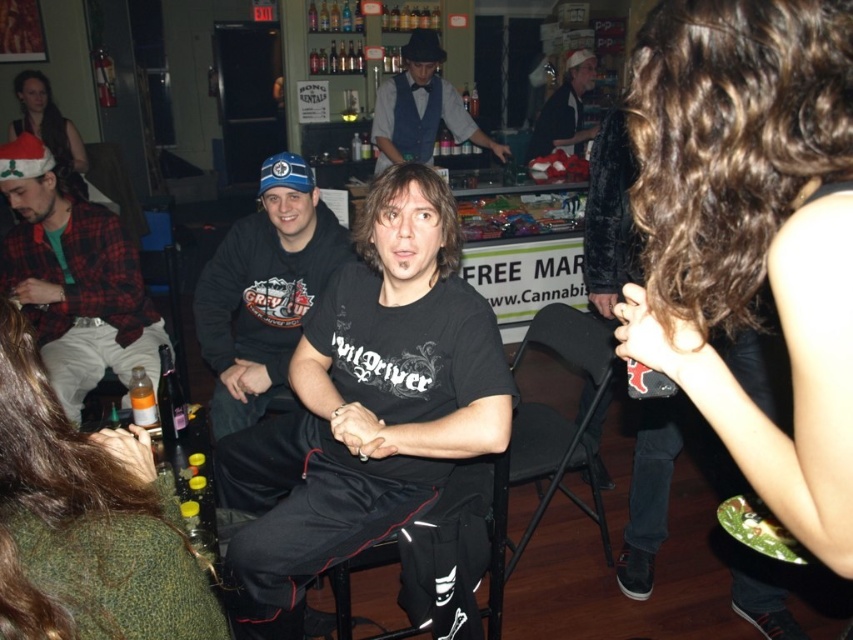
Question: Can you confirm if black matte t-shirt at center is wider than matte black shirt at center?

Choices:
 (A) no
 (B) yes

Answer: (B)

Question: Is black matte t-shirt at center bigger than black matte shirt at center?

Choices:
 (A) no
 (B) yes

Answer: (B)

Question: Among these objects, which one is nearest to the camera?

Choices:
 (A) black matte shirt at center
 (B) matte black shirt at center

Answer: (A)

Question: Does flannel shirt at left appear over matte black shirt at center?

Choices:
 (A) no
 (B) yes

Answer: (A)

Question: Which of the following is the closest to the observer?

Choices:
 (A) (379, 163)
 (B) (155, 524)
 (C) (294, 285)

Answer: (B)

Question: Among these objects, which one is nearest to the camera?

Choices:
 (A) matte black shirt at center
 (B) black matte t-shirt at center
 (C) santa hat at upper left

Answer: (B)